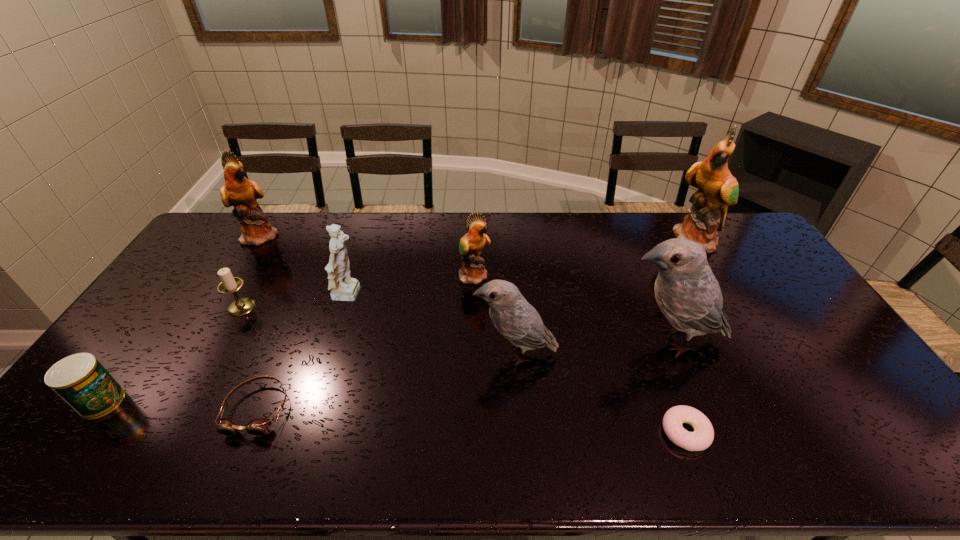
Where is `vacant space located on the front-facing side of the right gray parrot`? The image size is (960, 540). vacant space located on the front-facing side of the right gray parrot is located at coordinates (489, 341).

Where is `free space located on the front-facing side of the figurine`? free space located on the front-facing side of the figurine is located at coordinates (436, 296).

Locate an element on the screen. This screenshot has width=960, height=540. vacant space located 0.120m on the front-facing side of the third nearest parrot is located at coordinates (525, 275).

Where is `vacant space located on the front-facing side of the left gray parrot`? This screenshot has height=540, width=960. vacant space located on the front-facing side of the left gray parrot is located at coordinates pyautogui.click(x=381, y=353).

Locate an element on the screen. Image resolution: width=960 pixels, height=540 pixels. vacant space situated 0.340m on the front-facing side of the left gray parrot is located at coordinates (353, 353).

Where is `free space located on the front-facing side of the left gray parrot`? Image resolution: width=960 pixels, height=540 pixels. free space located on the front-facing side of the left gray parrot is located at coordinates (456, 353).

This screenshot has width=960, height=540. I want to click on free space located 0.200m on the back of the white candle holder, so click(269, 258).

Find the location of `free space located 0.170m on the right of the can`. free space located 0.170m on the right of the can is located at coordinates (188, 402).

Where is `vacant space located through the lenses of the ninth tallest object`? The width and height of the screenshot is (960, 540). vacant space located through the lenses of the ninth tallest object is located at coordinates click(x=233, y=468).

At what (x,y) coordinates should I click in order to perform the action: click on free region located on the back of the pink doughnut. Please return your answer as a coordinate pair (x, y). Looking at the image, I should click on (644, 320).